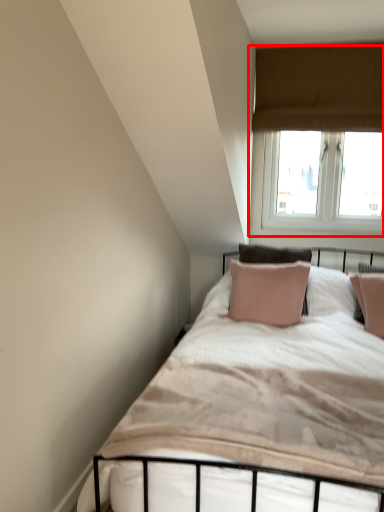
Question: In this image, where is window (annotated by the red box) located relative to bed?

Choices:
 (A) right
 (B) left

Answer: (A)